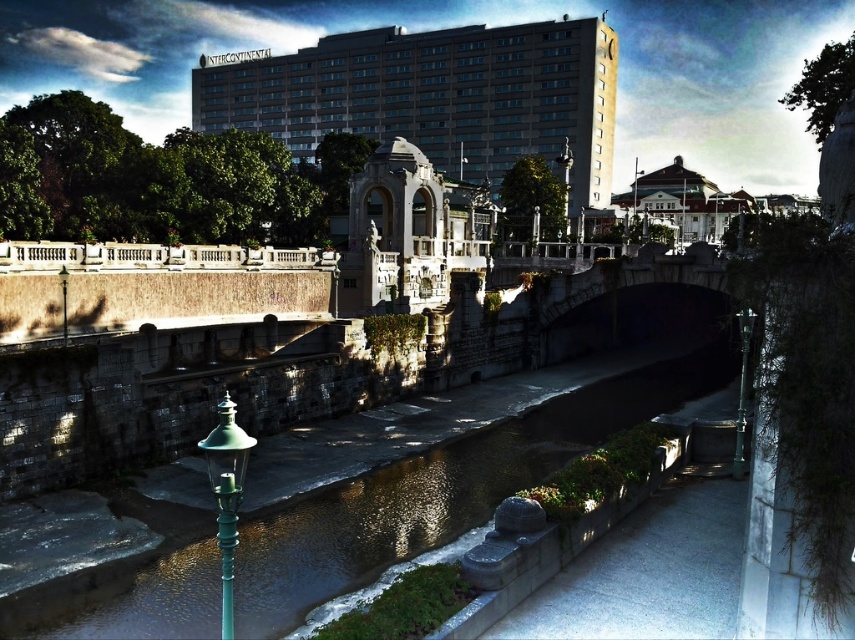
Question: Which point is closer to the camera?

Choices:
 (A) (228, 580)
 (B) (223, 636)
 (C) (563, 150)
 (D) (142, 611)

Answer: (A)

Question: Can you confirm if green metallic pole at lower left is wider than green glass lamp post at right?

Choices:
 (A) no
 (B) yes

Answer: (A)

Question: Based on their relative distances, which object is farther from the green glass lamp post at right?

Choices:
 (A) dark stone river at center
 (B) green painted metal lamp post at lower left
 (C) blue glass building at upper center
 (D) green metallic pole at lower left

Answer: (C)

Question: Which object is positioned farthest from the green metallic pole at lower left?

Choices:
 (A) green glass lamp post at right
 (B) dark stone river at center

Answer: (A)

Question: Considering the relative positions of dark stone river at center and green glass lamp post at right in the image provided, where is dark stone river at center located with respect to green glass lamp post at right?

Choices:
 (A) right
 (B) left

Answer: (B)

Question: Is green painted metal lamp post at lower left above green glass lamp post at right?

Choices:
 (A) yes
 (B) no

Answer: (B)